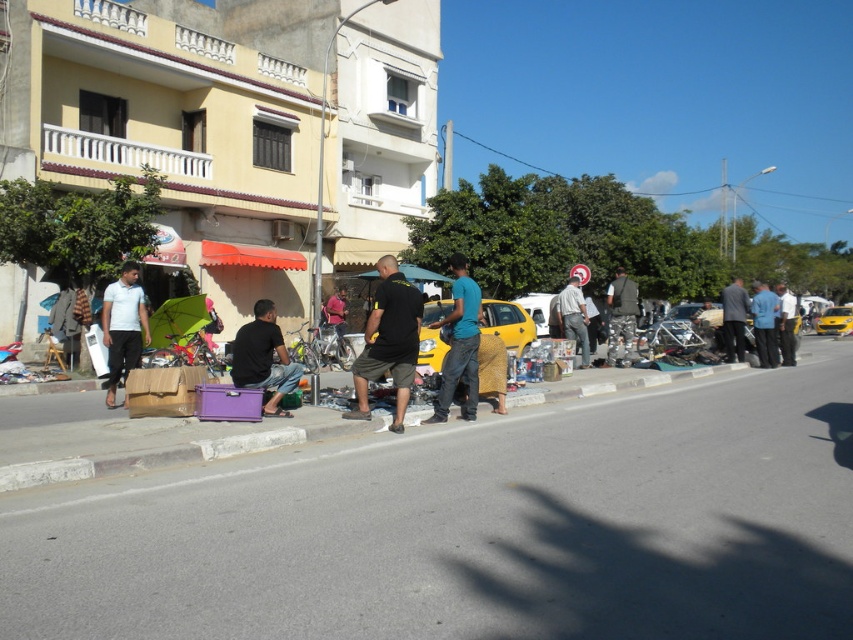
Question: Which point is closer to the camera?

Choices:
 (A) black matte shirt at lower left
 (B) white matte shirt at left
 (C) concrete at lower center
 (D) black cotton t-shirt at center

Answer: (C)

Question: Can you confirm if black matte shirt at lower left is smaller than white matte shirt at left?

Choices:
 (A) yes
 (B) no

Answer: (B)

Question: Is black cotton t-shirt at center below white matte shirt at left?

Choices:
 (A) yes
 (B) no

Answer: (B)

Question: Does concrete at lower center appear on the right side of white matte shirt at left?

Choices:
 (A) yes
 (B) no

Answer: (A)

Question: Which of the following is the closest to the observer?

Choices:
 (A) (276, 400)
 (B) (115, 291)
 (C) (392, 356)
 (D) (129, 470)

Answer: (D)

Question: Which point is closer to the camera?

Choices:
 (A) (397, 282)
 (B) (318, 435)

Answer: (B)